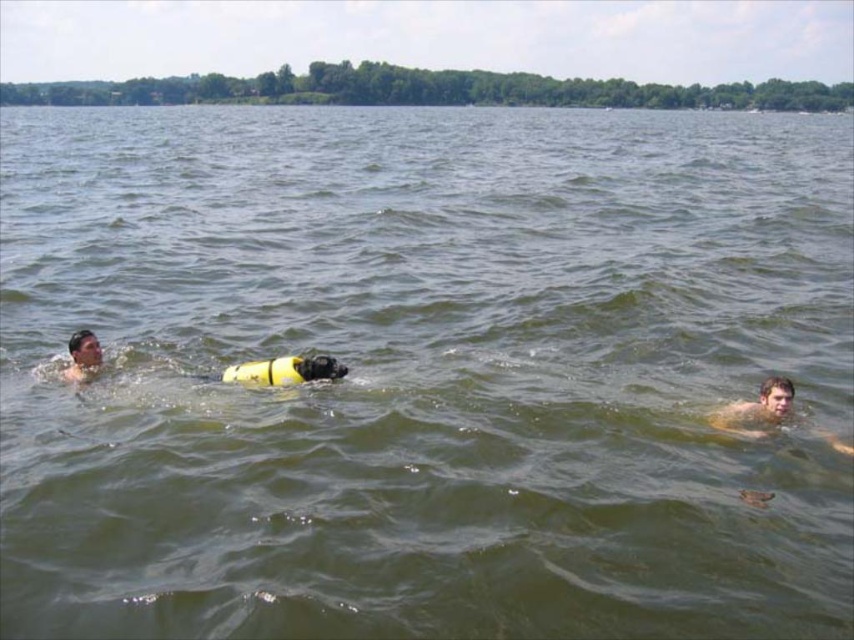
Which is in front, point (775, 410) or point (73, 360)?

Point (775, 410)

Which is in front, point (728, 419) or point (74, 332)?

Point (728, 419)

In order to click on smooth skin diver at right in this screenshot , I will do `click(758, 410)`.